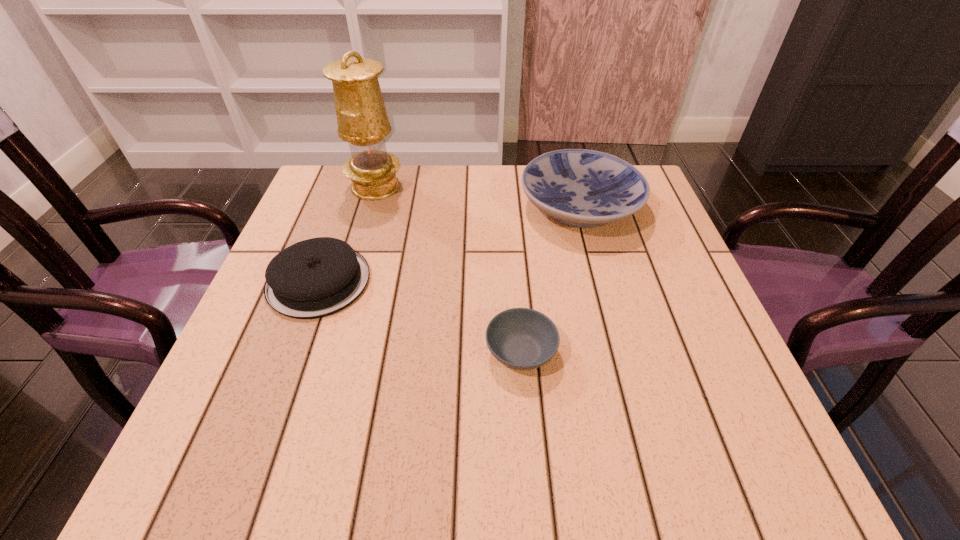
Identify the location of oil lamp that is positioned at the far edge. (362, 120).

This screenshot has height=540, width=960. In order to click on plate present at the far edge in this screenshot , I will do `click(583, 188)`.

Find the location of a particular element. Image resolution: width=960 pixels, height=540 pixels. oil lamp present at the left edge is located at coordinates (362, 120).

Locate an element on the screen. pancake at the left edge is located at coordinates (317, 277).

The width and height of the screenshot is (960, 540). In order to click on object located in the right edge section of the desktop in this screenshot , I will do `click(583, 188)`.

I want to click on object at the far left corner, so click(x=362, y=120).

The height and width of the screenshot is (540, 960). In order to click on object at the far right corner in this screenshot , I will do `click(583, 188)`.

Locate an element on the screen. The height and width of the screenshot is (540, 960). vacant space at the far edge of the desktop is located at coordinates tap(379, 219).

At what (x,y) coordinates should I click in order to perform the action: click on blank space at the near edge of the desktop. Please return your answer as a coordinate pair (x, y). This screenshot has height=540, width=960. Looking at the image, I should click on (359, 437).

Locate an element on the screen. The image size is (960, 540). vacant region at the left edge of the desktop is located at coordinates (299, 408).